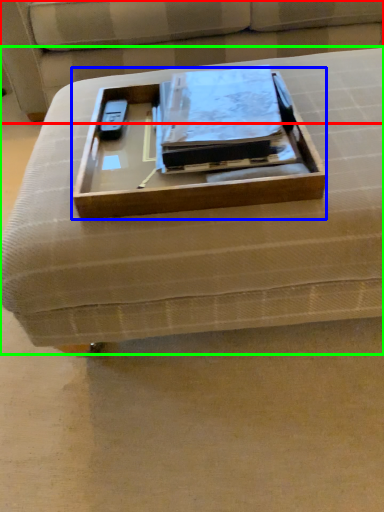
Question: Estimate the real-world distances between objects in this image. Which object is closer to couch (highlighted by a red box), box (highlighted by a blue box) or furniture (highlighted by a green box)?

Choices:
 (A) box
 (B) furniture

Answer: (A)